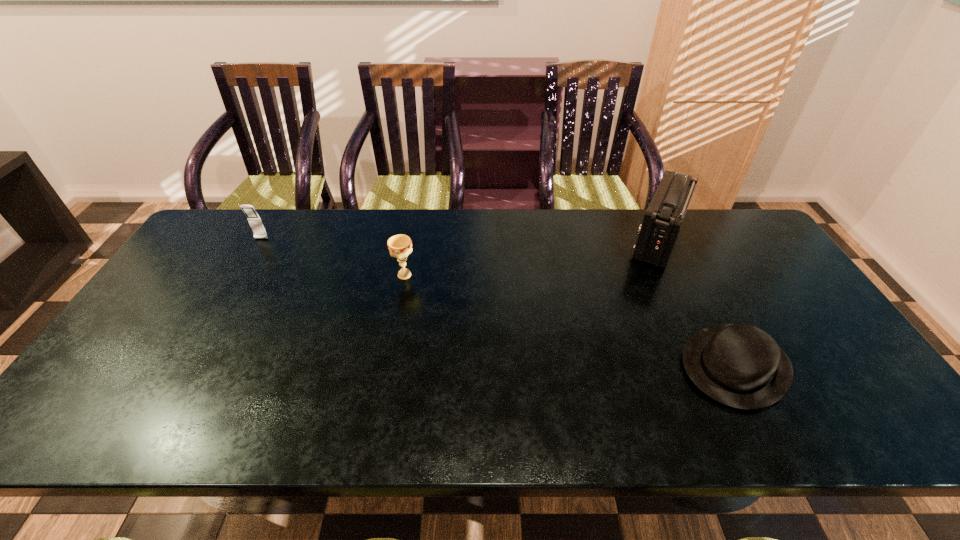
The width and height of the screenshot is (960, 540). In order to click on vacant space at the near left corner in this screenshot , I will do point(80,434).

You are a GUI agent. You are given a task and a screenshot of the screen. Output one action in this format:
    pyautogui.click(x=<x>, y=<y>)
    Task: Click on the vacant area that lies between the fedora and the leftmost object
    The image size is (960, 540).
    Given the screenshot: What is the action you would take?
    pyautogui.click(x=498, y=302)

Image resolution: width=960 pixels, height=540 pixels. I want to click on empty space between the tallest object and the leftmost object, so click(460, 240).

This screenshot has width=960, height=540. What are the coordinates of `free spot between the chalice and the cellular telephone` in the screenshot? It's located at (333, 257).

Where is `free area in between the tallest object and the fedora`? free area in between the tallest object and the fedora is located at coordinates (697, 303).

This screenshot has width=960, height=540. What are the coordinates of `vacant area that lies between the radio receiver and the leftmost object` in the screenshot? It's located at coord(460,240).

This screenshot has height=540, width=960. In order to click on vacant space that's between the second object from left to right and the radio receiver in this screenshot , I will do `click(531, 258)`.

Locate an element on the screen. The height and width of the screenshot is (540, 960). unoccupied position between the cellular telephone and the radio receiver is located at coordinates (460, 240).

Where is `vacant area that lies between the third object from right to left and the shortest object`? The width and height of the screenshot is (960, 540). vacant area that lies between the third object from right to left and the shortest object is located at coordinates (570, 321).

At what (x,y) coordinates should I click in order to perform the action: click on free space between the nearest object and the radio receiver. Please return your answer as a coordinate pair (x, y). Looking at the image, I should click on (697, 303).